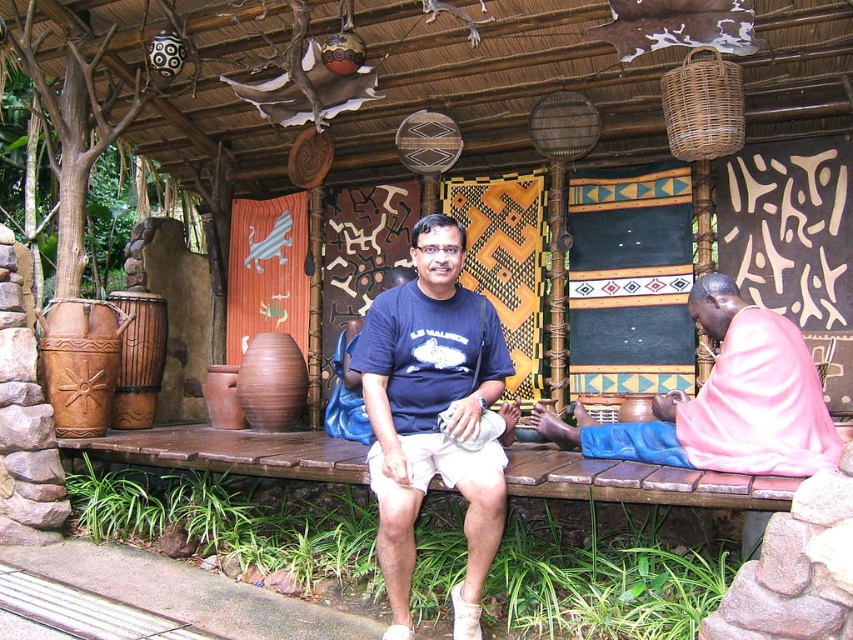
This screenshot has width=853, height=640. Identify the location of blue cotton t-shirt at center. (432, 416).

Does point (480, 301) come in front of point (119, 321)?

Yes.

Does point (424, 400) lie behind point (100, 371)?

No, (424, 400) is in front of (100, 371).

I want to click on blue cotton t-shirt at center, so click(432, 416).

Locate an element on the screen. pink fabric at right is located at coordinates coord(724,401).

What do you see at coordinates (724, 401) in the screenshot? I see `pink fabric at right` at bounding box center [724, 401].

Between point (614, 442) and point (79, 420), which one is positioned behind?

Positioned behind is point (79, 420).

This screenshot has width=853, height=640. In order to click on pink fabric at right in this screenshot , I will do `click(724, 401)`.

Can you confirm if pink fabric at right is taller than brown matte vase at center?

Yes.

Does point (834, 451) come farther from viewer compared to point (258, 364)?

No, it is not.

Is point (572, 436) behind point (236, 392)?

No.

Locate an element on the screen. pink fabric at right is located at coordinates (724, 401).